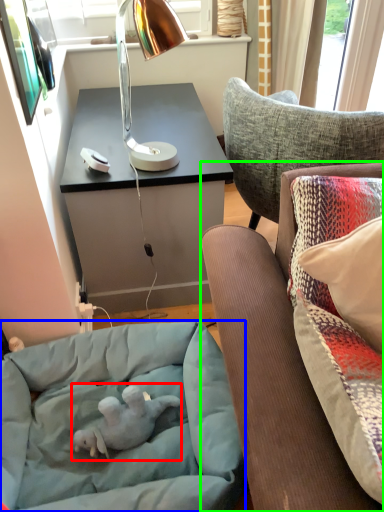
Question: Estimate the real-world distances between objects in this image. Which object is farther from baby elephant (highlighted by a red box), dog bed (highlighted by a blue box) or studio couch (highlighted by a green box)?

Choices:
 (A) dog bed
 (B) studio couch

Answer: (B)